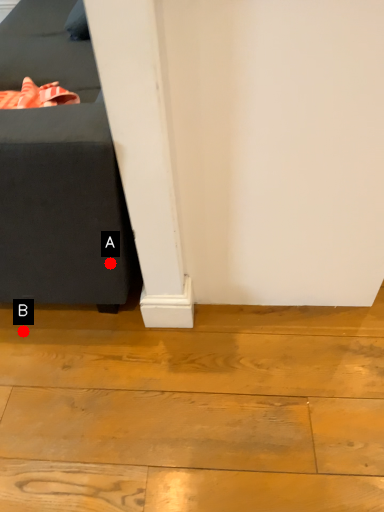
Question: Two points are circled on the image, labeled by A and B beside each circle. Which point is further to the camera?

Choices:
 (A) A is further
 (B) B is further

Answer: (B)